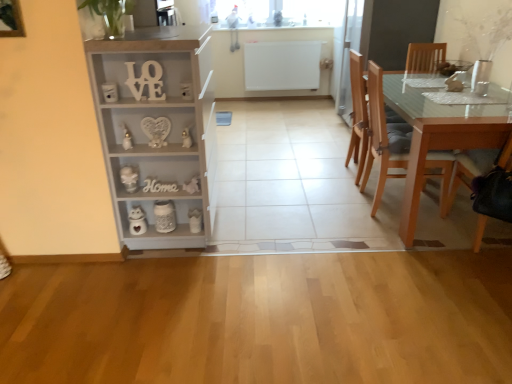
Question: From a real-world perspective, is light brown wooden chair at right, the 2th chair from the front, physically located above or below white matte wooden letters at upper center?

Choices:
 (A) below
 (B) above

Answer: (A)

Question: Is light brown wooden chair at right, which ranks as the 2th chair in back-to-front order, inside the boundaries of white matte wooden letters at upper center, or outside?

Choices:
 (A) inside
 (B) outside

Answer: (B)

Question: Estimate the real-world distances between objects in this image. Which object is farther from the light gray wood cabinet at left?

Choices:
 (A) wooden chair at right, the 3th chair when ordered from back to front
 (B) white glossy vase at lower left
 (C) light brown wooden chair at right, the 2th chair from the front
 (D) white matte wooden letters at upper center
 (E) light brown wooden table at right

Answer: (A)

Question: Which of these objects is positioned farthest from the light brown wood chair at right, acting as the third chair starting from the front?

Choices:
 (A) white matte wooden letters at upper center
 (B) wooden chair at right, placed as the first chair when sorted from front to back
 (C) light brown wooden chair at right, which ranks as the 2th chair in back-to-front order
 (D) light gray wood cabinet at left
 (E) white glossy vase at lower left

Answer: (E)